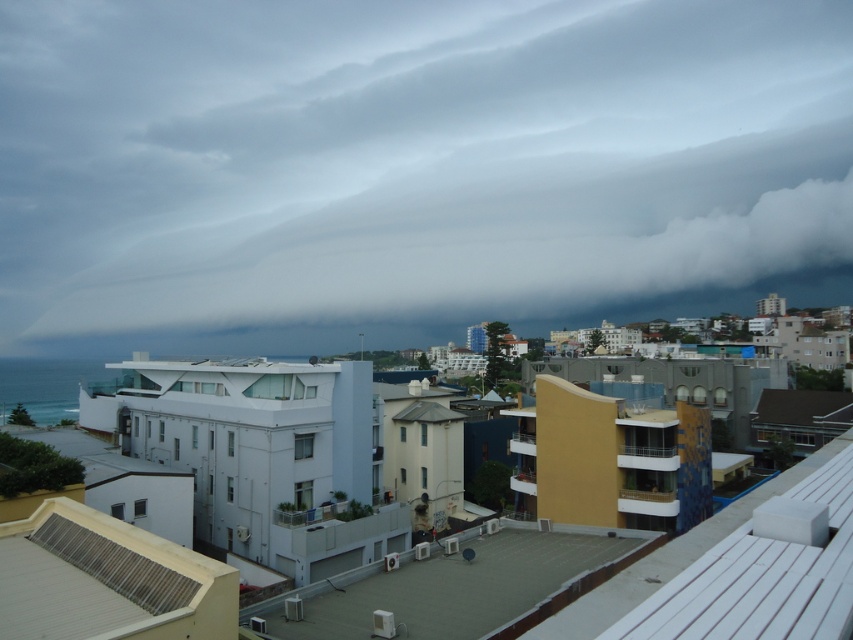
You are standing at the center of the coastal urban area shown in the image. Looking towards the horizon, you notice a point marked at coordinates (410, 170). What object is located at this point?

The point at coordinates (410, 170) corresponds to a gray cloud at upper center.